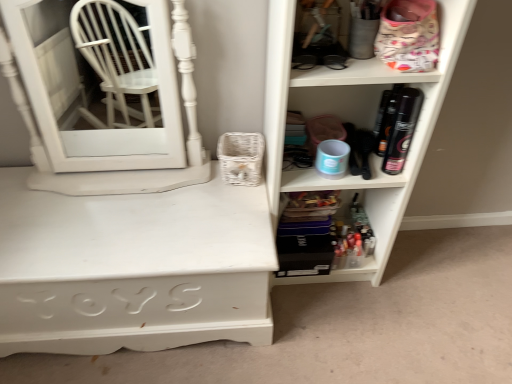
Question: Is matte white shelf at right, which ranks as the 2th shelf in bottom-to-top order, facing away from translucent plastic containers at lower center, which is counted as the second shelf, starting from the top?

Choices:
 (A) yes
 (B) no

Answer: (A)

Question: Is matte white shelf at right, placed as the 1th shelf when sorted from top to bottom, to the right of translucent plastic containers at lower center, marked as the 1th shelf in a bottom-to-top arrangement, from the viewer's perspective?

Choices:
 (A) no
 (B) yes

Answer: (B)

Question: Is matte white shelf at right, which ranks as the 2th shelf in bottom-to-top order, not close to translucent plastic containers at lower center, marked as the 1th shelf in a bottom-to-top arrangement?

Choices:
 (A) no
 (B) yes

Answer: (A)

Question: Would you say matte white shelf at right, placed as the 1th shelf when sorted from top to bottom, contains translucent plastic containers at lower center, which is counted as the second shelf, starting from the top?

Choices:
 (A) no
 (B) yes

Answer: (B)

Question: From the image's perspective, is matte white shelf at right, placed as the 1th shelf when sorted from top to bottom, beneath translucent plastic containers at lower center, which is counted as the second shelf, starting from the top?

Choices:
 (A) no
 (B) yes

Answer: (A)

Question: Does matte white shelf at right, which ranks as the 2th shelf in bottom-to-top order, appear on the left side of translucent plastic containers at lower center, which is counted as the second shelf, starting from the top?

Choices:
 (A) no
 (B) yes

Answer: (A)

Question: Is white painted wood desk at lower left to the right of matte white shelf at right, placed as the 1th shelf when sorted from top to bottom, from the viewer's perspective?

Choices:
 (A) no
 (B) yes

Answer: (A)

Question: From a real-world perspective, is white painted wood desk at lower left positioned under matte white shelf at right, which ranks as the 2th shelf in bottom-to-top order, based on gravity?

Choices:
 (A) yes
 (B) no

Answer: (A)

Question: Does white painted wood desk at lower left have a greater height compared to matte white shelf at right, placed as the 1th shelf when sorted from top to bottom?

Choices:
 (A) yes
 (B) no

Answer: (B)

Question: From the image's perspective, is white painted wood desk at lower left above matte white shelf at right, which ranks as the 2th shelf in bottom-to-top order?

Choices:
 (A) yes
 (B) no

Answer: (B)

Question: Would you say white painted wood desk at lower left is outside matte white shelf at right, which ranks as the 2th shelf in bottom-to-top order?

Choices:
 (A) no
 (B) yes

Answer: (B)

Question: Considering the relative positions of white painted wood desk at lower left and matte white shelf at right, which ranks as the 2th shelf in bottom-to-top order, in the image provided, is white painted wood desk at lower left to the left of matte white shelf at right, which ranks as the 2th shelf in bottom-to-top order, from the viewer's perspective?

Choices:
 (A) yes
 (B) no

Answer: (A)

Question: Is translucent plastic containers at lower center, marked as the 1th shelf in a bottom-to-top arrangement, wider than white painted wood desk at lower left?

Choices:
 (A) no
 (B) yes

Answer: (A)